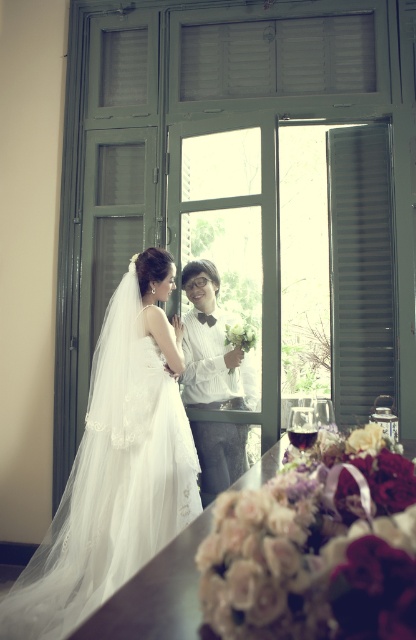
You are a photographer setting up for a wedding photo. You notice the black matte shutter at right and the white textured shirt at center. Which object should you focus on first if you want to capture the larger subject in your frame?

The white textured shirt at center should be focused on first because it is larger than the black matte shutter at right.